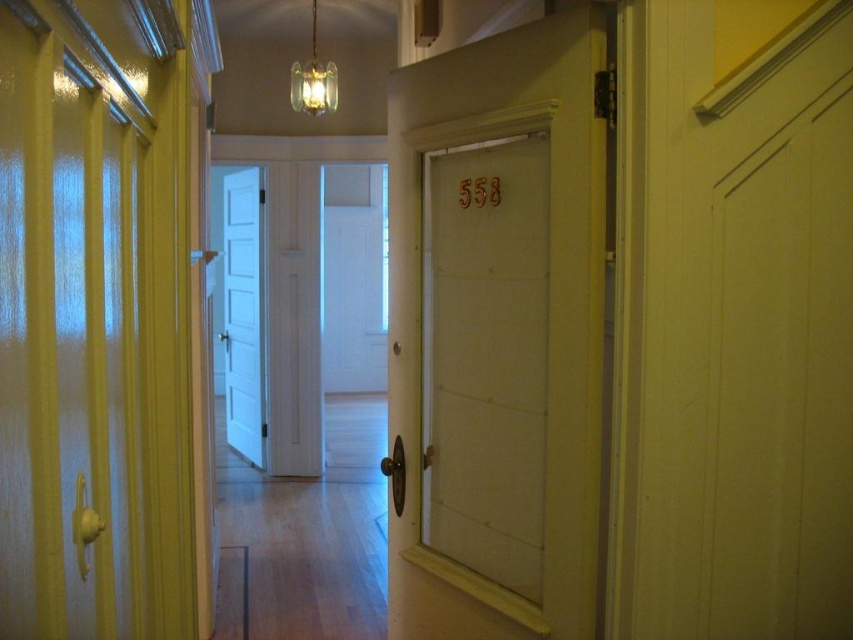
You are a delivery person holding a package for apartment 558. You see two doors at the end of the hallway, a white wooden door at center and a white painted wood door at center. According to the scene, which door should you approach first if you want to reach apartment 558?

The white wooden door at center is positioned on the right side of the white painted wood door at center. Since apartment 558 is on the right side of the hallway, you should approach the white wooden door at center first.

You are a delivery person holding a package and standing in the hallway. You need to deliver it to door number 558. Which door should you approach, the white wooden door at center or the white painted wood door at center?

The white painted wood door at center is taller than the white wooden door at center, so door number 558 is likely the white painted wood door at center since it has a taller frame to accommodate the number plate.

You are a delivery person trying to deliver a package to apartment 558. You see two doors at the center of the hallway, a white wooden door at center and a white painted wood door at center. Which door should you knock on to reach apartment 558?

The white wooden door at center is located below the white painted wood door at center. Since apartment numbers are typically placed on the door itself, you should knock on the white wooden door at center which has the number 558 displayed on it.